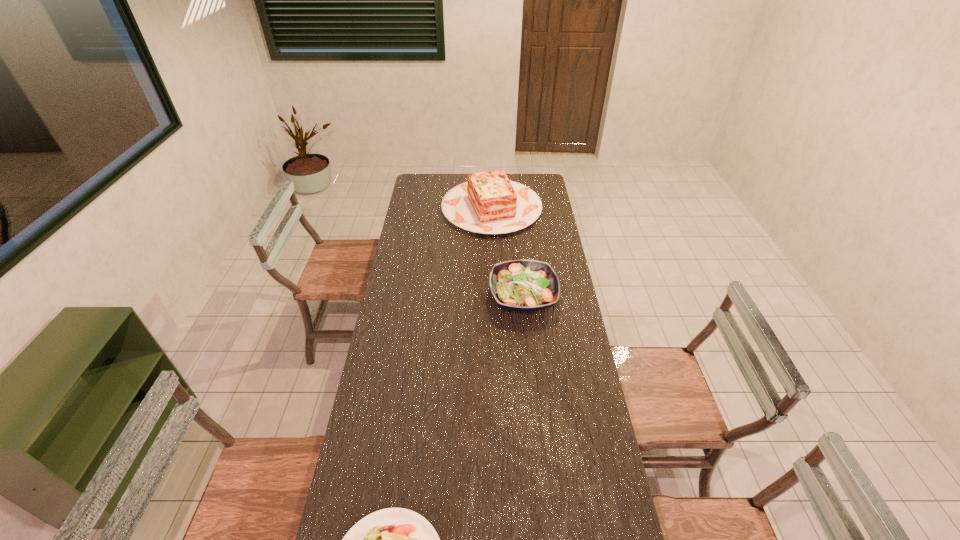
In order to click on free space at the left edge of the desktop in this screenshot , I will do `click(393, 458)`.

What are the coordinates of `vacant space at the right edge` in the screenshot? It's located at (540, 200).

The width and height of the screenshot is (960, 540). I want to click on vacant space at the far left corner, so click(x=429, y=191).

Identify the location of vacant region at the far right corner of the desktop. (540, 186).

Locate an element on the screen. unoccupied area between the tallest object and the second tallest object is located at coordinates (508, 253).

The image size is (960, 540). I want to click on vacant region between the second nearest object and the tallest object, so click(508, 253).

Where is `unoccupied position between the right salad plate and the farthest object`? unoccupied position between the right salad plate and the farthest object is located at coordinates (508, 253).

Find the location of a particular element. This screenshot has width=960, height=540. unoccupied position between the second nearest object and the farthest object is located at coordinates (508, 253).

Locate which object is the closest to the farthest object. Please provide its 2D coordinates. Your answer should be formatted as a tuple, i.e. [(x, y)], where the tuple contains the x and y coordinates of a point satisfying the conditions above.

[(522, 285)]

Find the location of a particular element. object that is the second closest to the nearer salad plate is located at coordinates (488, 203).